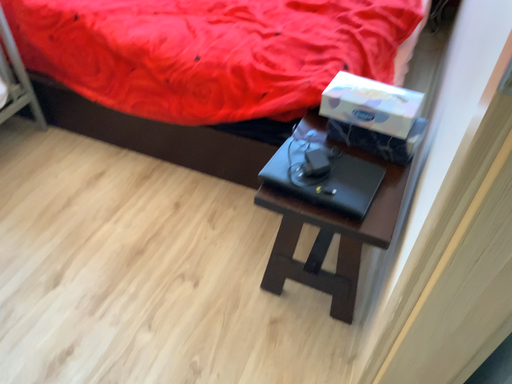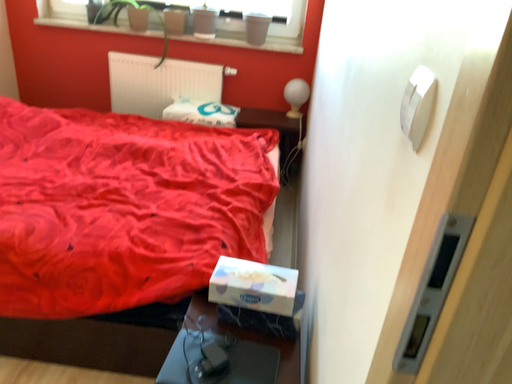
Question: Which way did the camera rotate in the video?

Choices:
 (A) rotated right
 (B) rotated left

Answer: (A)